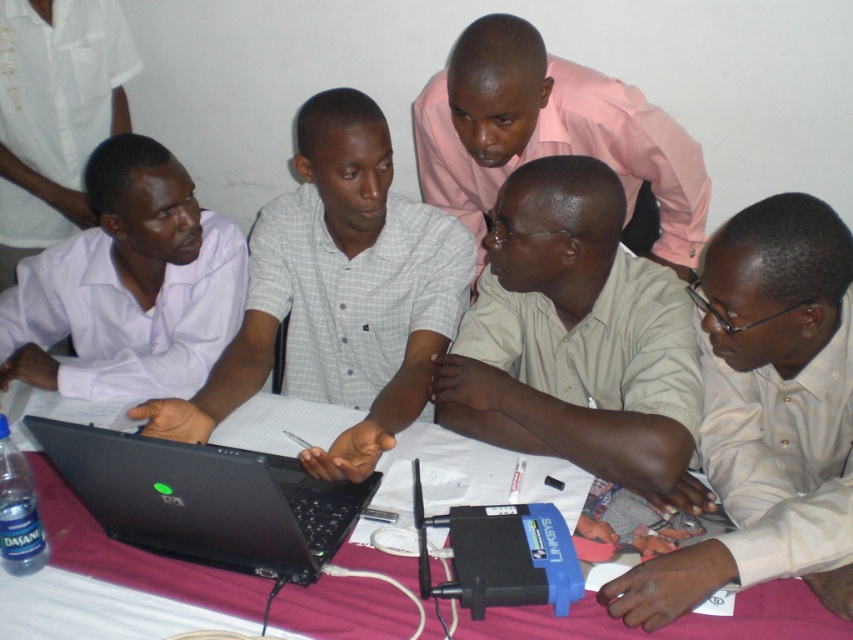
Who is shorter, beige shirt at center or matte white shirt at left?

Standing shorter between the two is matte white shirt at left.

Does beige shirt at center have a lesser height compared to matte white shirt at left?

No, beige shirt at center is not shorter than matte white shirt at left.

Image resolution: width=853 pixels, height=640 pixels. What do you see at coordinates (567, 333) in the screenshot? I see `beige shirt at center` at bounding box center [567, 333].

I want to click on beige shirt at center, so click(x=567, y=333).

Can you confirm if beige shirt at center is shorter than white shirt at left?

Indeed, beige shirt at center has a lesser height compared to white shirt at left.

Does beige shirt at center appear under white shirt at left?

Indeed, beige shirt at center is positioned under white shirt at left.

Is point (491, 428) positioned behind point (67, 228)?

No.

The image size is (853, 640). I want to click on beige shirt at center, so click(567, 333).

Based on the photo, can you confirm if purple fabric table at center is smaller than pink smooth shirt at upper center?

Incorrect, purple fabric table at center is not smaller in size than pink smooth shirt at upper center.

Is point (535, 636) positioned in front of point (643, 148)?

Yes, it is.

Where is `purple fabric table at center`? This screenshot has height=640, width=853. purple fabric table at center is located at coordinates (135, 556).